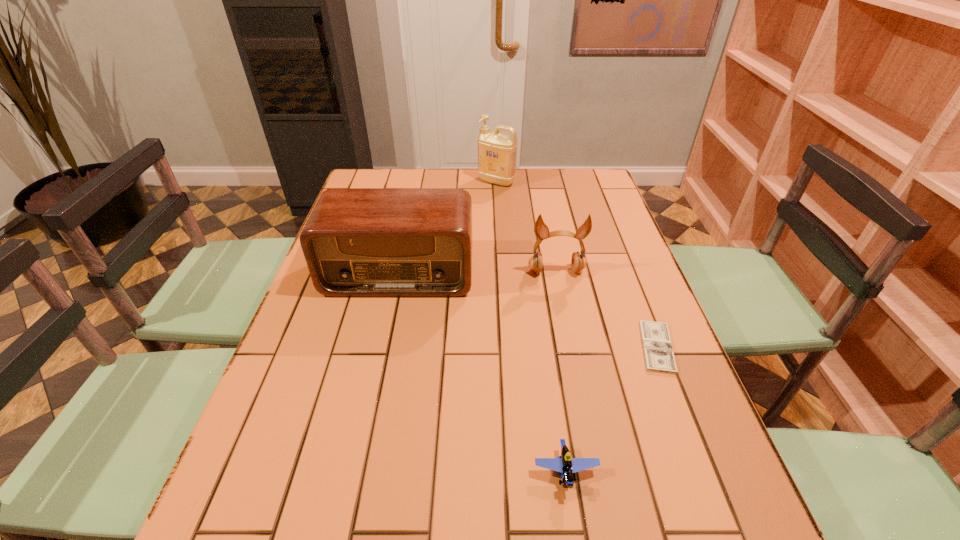
Where is `unoccupied position between the rightmost object and the fourth tallest object`? This screenshot has width=960, height=540. unoccupied position between the rightmost object and the fourth tallest object is located at coordinates pyautogui.click(x=611, y=410).

The height and width of the screenshot is (540, 960). I want to click on free area in between the radio receiver and the earphone, so click(x=478, y=272).

At what (x,y) coordinates should I click in order to perform the action: click on free space between the earphone and the leftmost object. Please return your answer as a coordinate pair (x, y). The width and height of the screenshot is (960, 540). Looking at the image, I should click on (478, 272).

The width and height of the screenshot is (960, 540). I want to click on vacant space in between the detergent and the earphone, so click(x=526, y=226).

I want to click on vacant space that's between the earphone and the fourth tallest object, so click(x=561, y=372).

Where is `free space between the earphone and the second nearest object`? free space between the earphone and the second nearest object is located at coordinates (607, 309).

Locate an element on the screen. free space that is in between the second shortest object and the rightmost object is located at coordinates (611, 410).

The height and width of the screenshot is (540, 960). I want to click on the fourth closest object to the earphone, so click(565, 465).

The height and width of the screenshot is (540, 960). I want to click on object that is the fourth closest to the Lego, so [x=497, y=152].

At what (x,y) coordinates should I click in order to perform the action: click on free spot that satisfies the following two spatial constraints: 1. on the front panel of the radio receiver; 2. on the right side of the fourth farthest object. Please return your answer as a coordinate pair (x, y). Looking at the image, I should click on (383, 347).